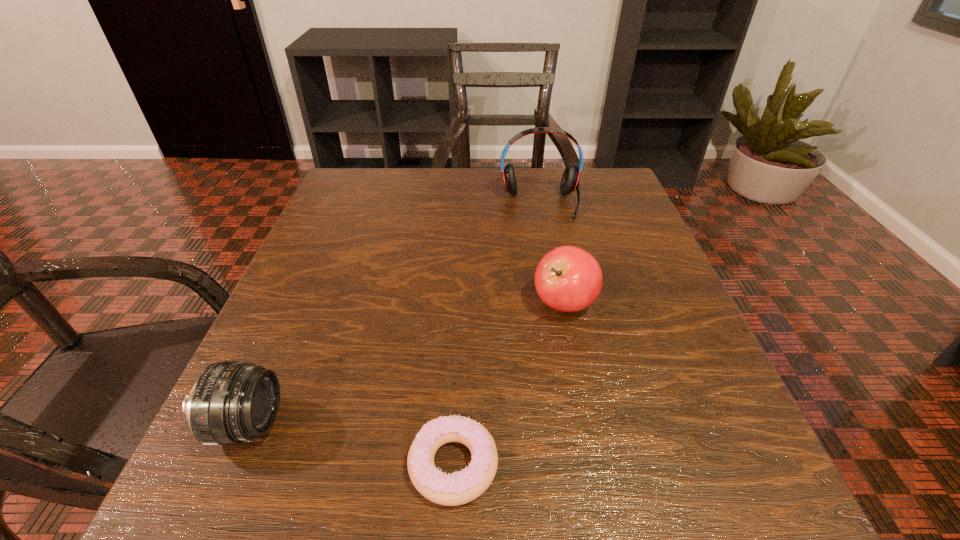
In the image, there is a desktop. Find the location of `free space at the right edge`. free space at the right edge is located at coordinates (572, 237).

In the image, there is a desktop. Identify the location of vacant space at the far left corner. The width and height of the screenshot is (960, 540). pyautogui.click(x=340, y=197).

Find the location of `vacant space at the near left corner of the desktop`. vacant space at the near left corner of the desktop is located at coordinates (221, 502).

Locate an element on the screen. This screenshot has height=540, width=960. vacant space at the far right corner of the desktop is located at coordinates (598, 194).

Where is `free space at the near right corner`? This screenshot has height=540, width=960. free space at the near right corner is located at coordinates (777, 528).

You are a GUI agent. You are given a task and a screenshot of the screen. Output one action in this format:
    pyautogui.click(x=<x>, y=<y>)
    Task: Click on the free area in between the second farthest object and the doughnut
    The image size is (960, 540).
    Given the screenshot: What is the action you would take?
    pyautogui.click(x=509, y=384)

Locate an element on the screen. The image size is (960, 540). vacant region between the doughnut and the third nearest object is located at coordinates (509, 384).

Locate an element on the screen. vacant space that is in between the headset and the telephoto lens is located at coordinates (394, 314).

The image size is (960, 540). I want to click on vacant point located between the telephoto lens and the apple, so click(x=406, y=364).

I want to click on unoccupied position between the apple and the doughnut, so click(509, 384).